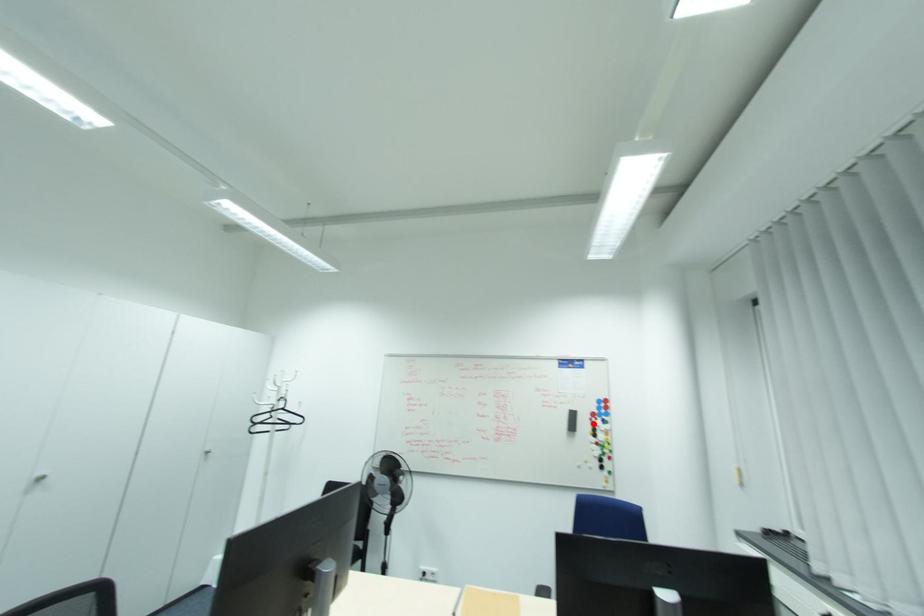
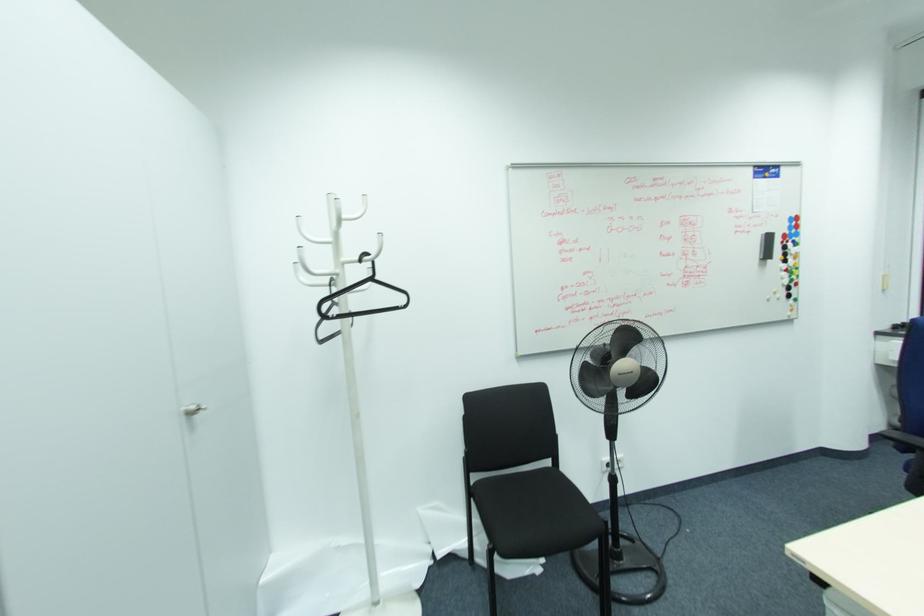
Where in the second image is the point corresponding to the highlighted location from the first image?

(785, 248)